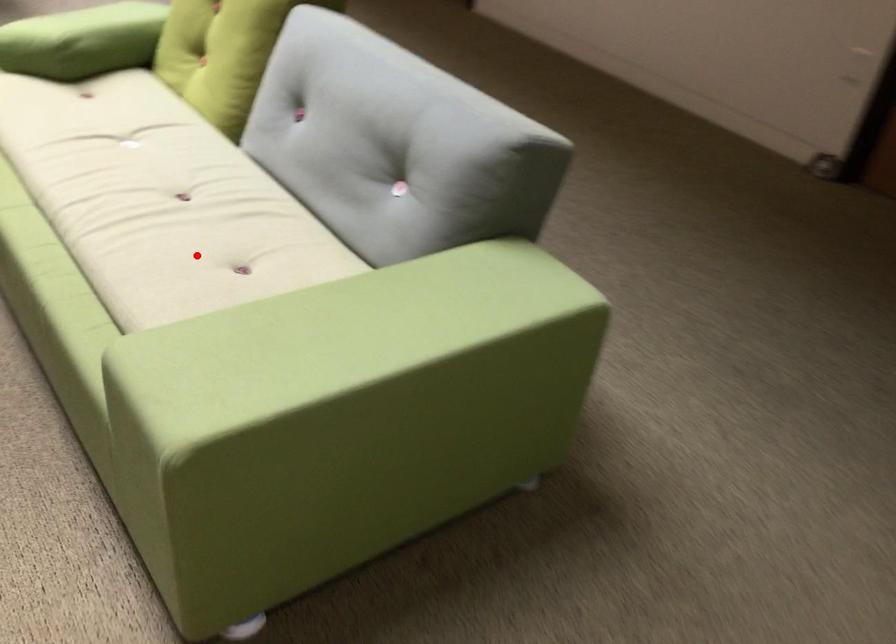
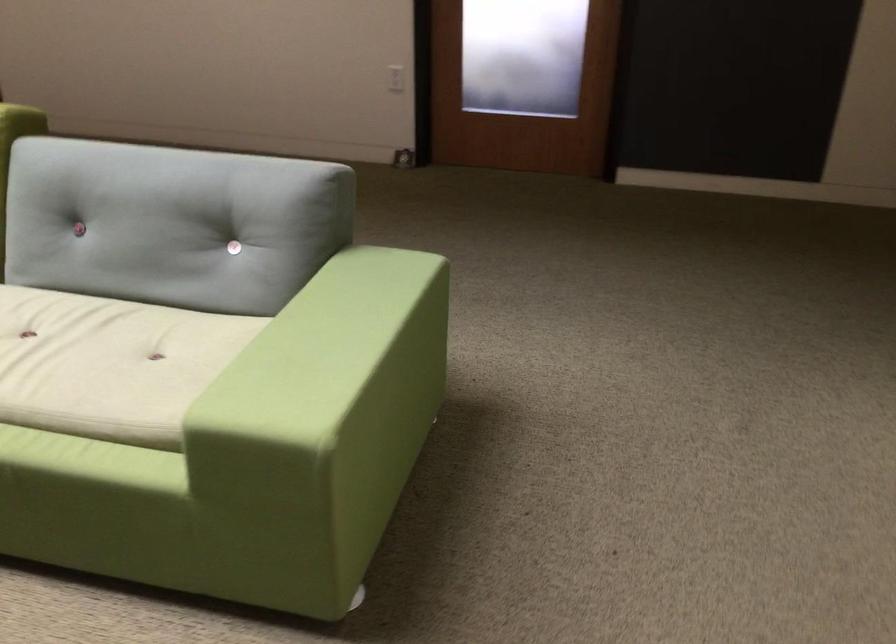
The point at the highlighted location is marked in the first image. Where is the corresponding point in the second image?

(109, 364)